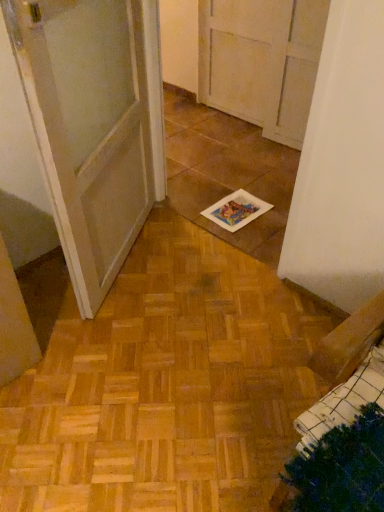
Where is `vacant space behind white paper at center`? The image size is (384, 512). vacant space behind white paper at center is located at coordinates (237, 184).